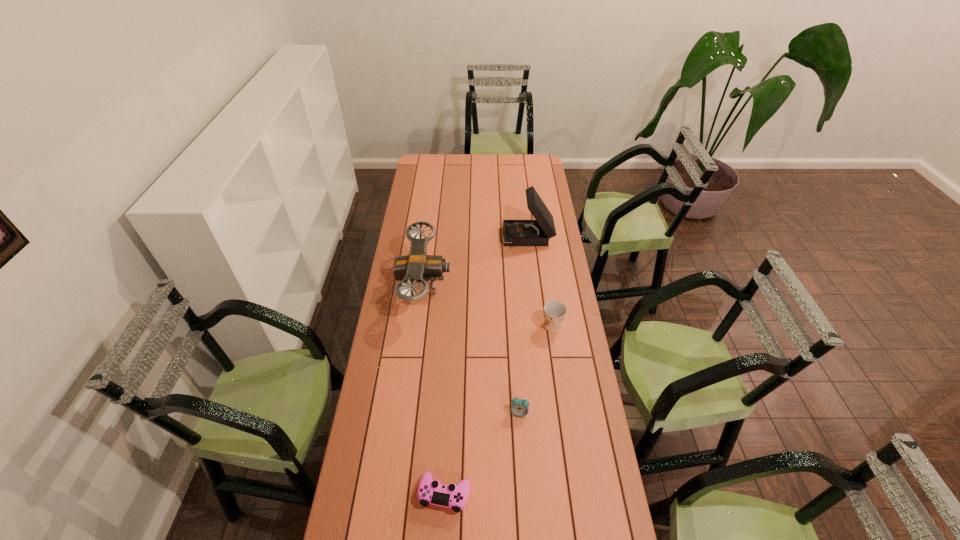
Find the location of a particular element. vacant point located 0.160m on the front-facing side of the drone is located at coordinates (487, 286).

The image size is (960, 540). I want to click on vacant space positioned 0.060m on the back of the third shortest object, so click(x=550, y=307).

Where is `free space located on the face of the alarm clock`? free space located on the face of the alarm clock is located at coordinates [524, 478].

You are a GUI agent. You are given a task and a screenshot of the screen. Output one action in this format:
    pyautogui.click(x=<x>, y=<y>)
    Task: Click on the free region located on the left of the shortest object
    
    Given the screenshot: What is the action you would take?
    click(x=370, y=494)

I want to click on object at the left edge, so click(417, 266).

Locate an element on the screen. phonograph_record at the right edge is located at coordinates (537, 232).

Locate an element on the screen. The image size is (960, 540). Dixie cup positioned at the right edge is located at coordinates (554, 311).

In the image, there is a desktop. Identify the location of vacant space at the far edge. (516, 166).

I want to click on vacant region at the left edge of the desktop, so click(424, 185).

In order to click on vacant space at the right edge in this screenshot , I will do `click(569, 355)`.